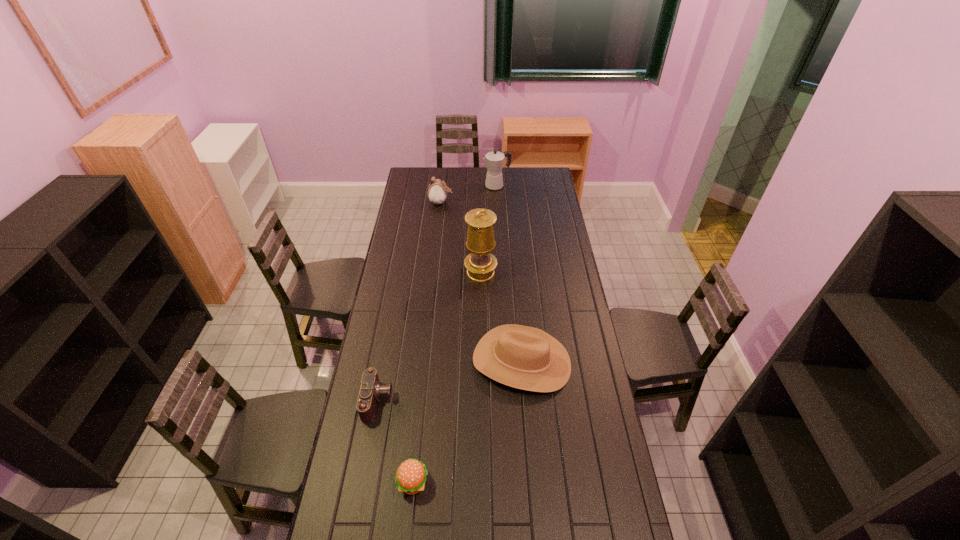
Where is `free space at the far left corner of the desktop`? The height and width of the screenshot is (540, 960). free space at the far left corner of the desktop is located at coordinates (420, 168).

Find the location of a particular element. This screenshot has height=540, width=960. blank area at the far right corner is located at coordinates point(535,171).

You are a GUI agent. You are given a task and a screenshot of the screen. Output one action in this format:
    pyautogui.click(x=<x>, y=<y>)
    Task: Click on the blank region between the hamburger and the pouch
    The width and height of the screenshot is (960, 540).
    Given the screenshot: What is the action you would take?
    pyautogui.click(x=427, y=342)

Identify the location of empty location between the leftmost object and the cowboy hat. This screenshot has height=540, width=960. (449, 381).

This screenshot has height=540, width=960. I want to click on free spot between the tallest object and the cowboy hat, so click(501, 317).

This screenshot has height=540, width=960. I want to click on free area in between the second farthest object and the second tallest object, so click(468, 194).

This screenshot has width=960, height=540. Identify the location of unoccupied position between the leftmost object and the oil lamp. (429, 336).

You are a GUI agent. You are given a task and a screenshot of the screen. Output one action in this format:
    pyautogui.click(x=<x>, y=<y>)
    Task: Click on the vacant space that is in between the leftmost object and the fifth shortest object
    
    Given the screenshot: What is the action you would take?
    pyautogui.click(x=437, y=293)

Identify the location of free space between the coffeepot and the camera. (437, 293).

Identify which object is the second nearest to the leftmost object. Please provide its 2D coordinates. Your answer should be formatted as a tuple, i.e. [(x, y)], where the tuple contains the x and y coordinates of a point satisfying the conditions above.

[(523, 357)]